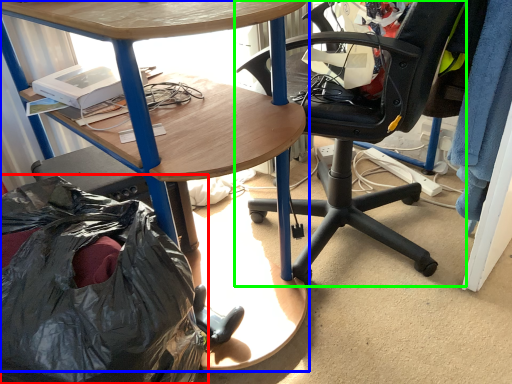
Question: Which object is positioned closest to garbage (highlighted by a red box)? Select from desk (highlighted by a blue box) and chair (highlighted by a green box).

Choices:
 (A) desk
 (B) chair

Answer: (A)